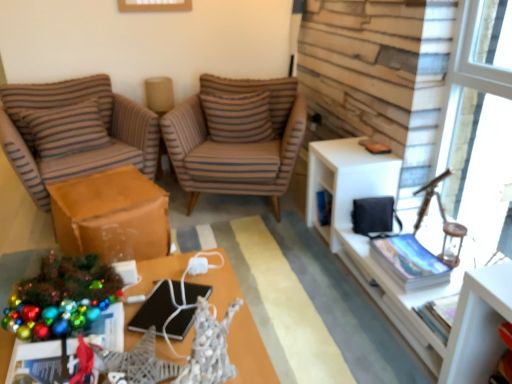
I want to click on vacant space situated above black matte laptop at center (from a real-world perspective), so click(165, 296).